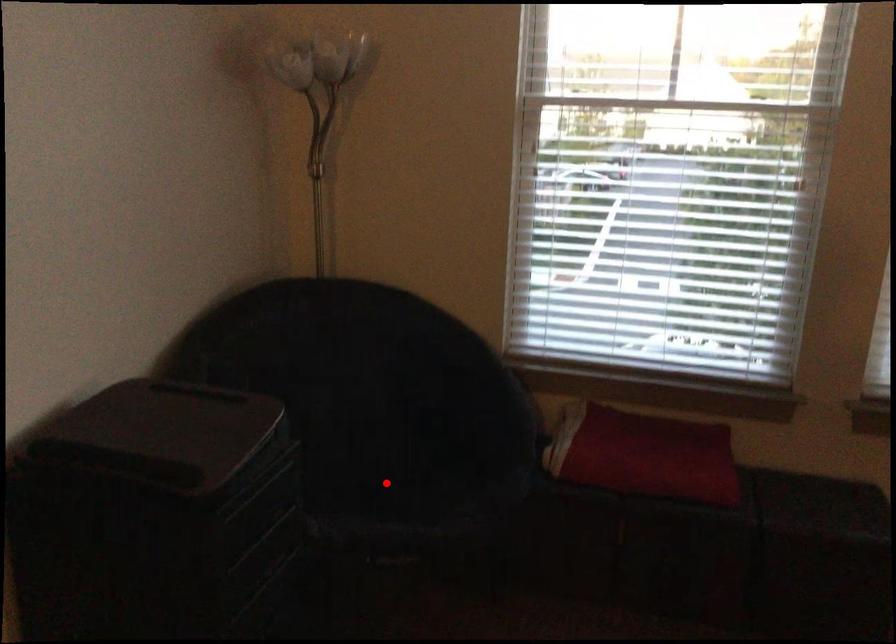
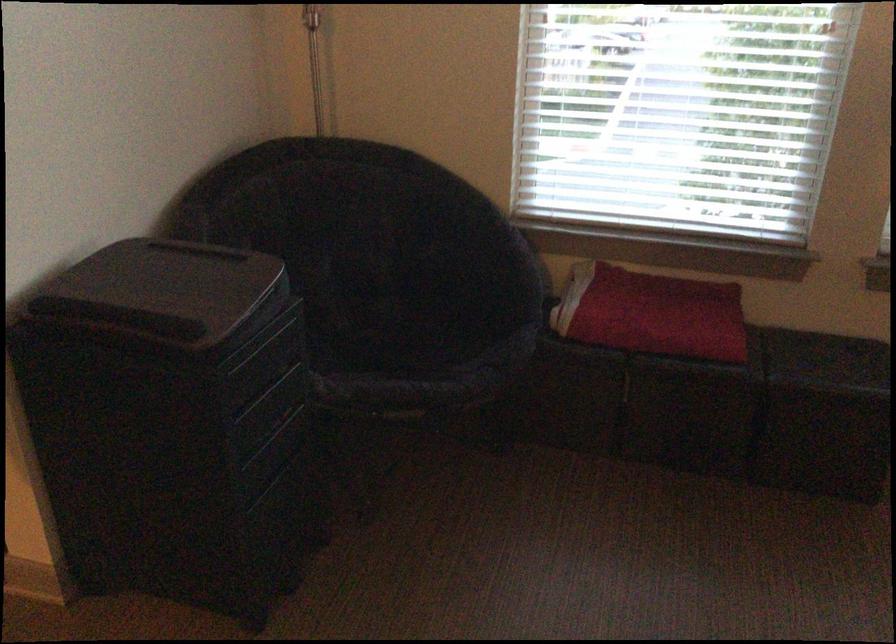
In the second image, find the point that corresponds to the highlighted location in the first image.

(393, 339)